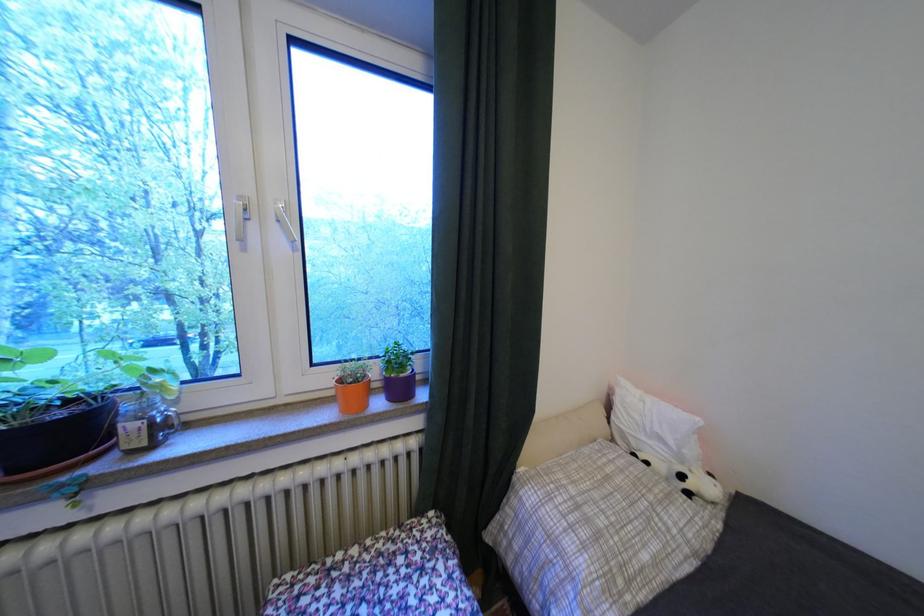
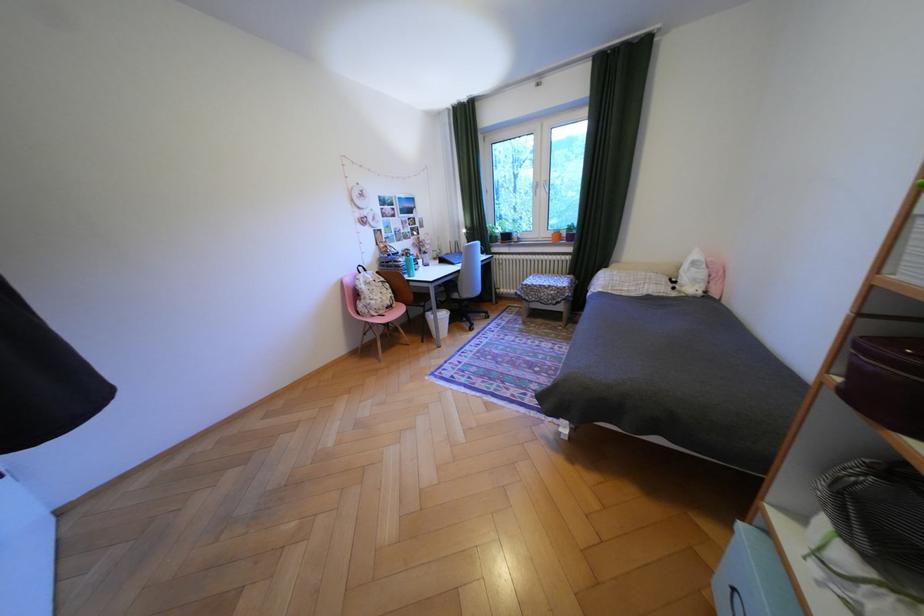
In the second image, find the point that corresponds to (264,227) in the first image.

(551, 190)